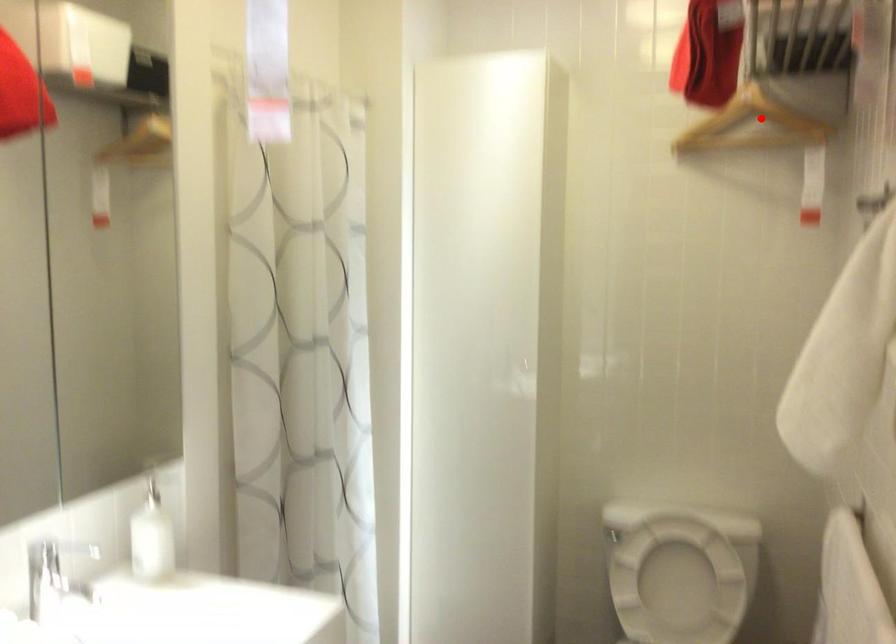
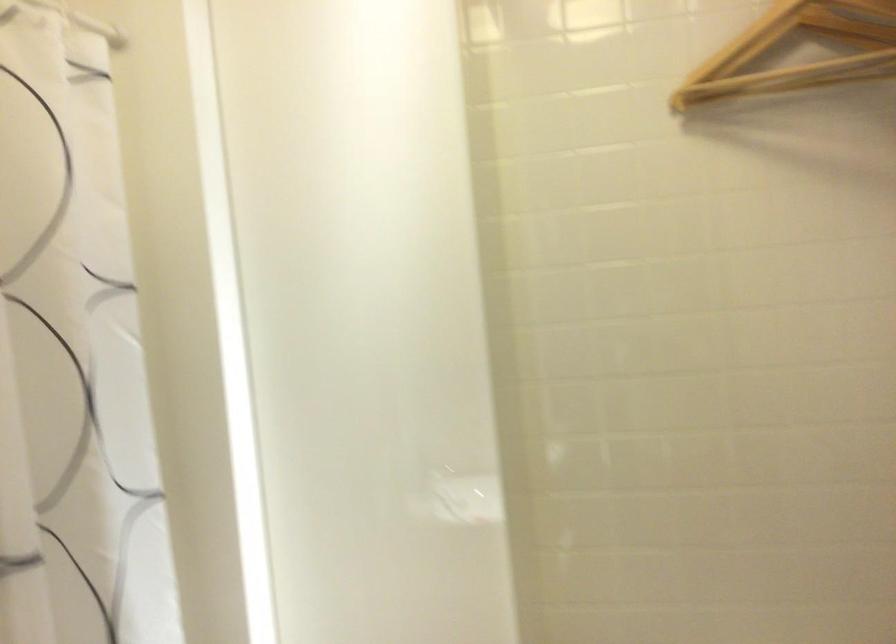
Question: I am providing you with two images of the same scene from different viewpoints. Given a red point in image1, look at the same physical point in image2. Is it:

Choices:
 (A) Closer to the viewpoint
 (B) Farther from the viewpoint

Answer: (A)